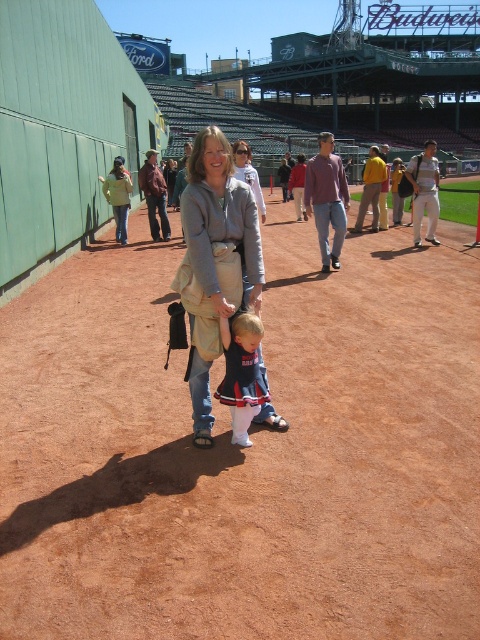
Question: From the image, what is the correct spatial relationship of matte gray sweatshirt at center in relation to matte blue dress at center?

Choices:
 (A) above
 (B) below

Answer: (A)

Question: Which point appears farthest from the camera in this image?

Choices:
 (A) (180, 196)
 (B) (220, 390)
 (C) (233, 564)

Answer: (A)

Question: Which object appears farthest from the camera in this image?

Choices:
 (A) matte gray hoodie at center
 (B) brown dirt field at center

Answer: (A)

Question: Which point appears farthest from the camera in this image?

Choices:
 (A) (372, 324)
 (B) (379, 188)
 (C) (260, 340)

Answer: (B)

Question: Can you confirm if matte gray hoodie at center is positioned above matte gray sweatshirt at center?

Choices:
 (A) yes
 (B) no

Answer: (B)

Question: Does matte gray sweatshirt at center have a greater width compared to matte blue dress at center?

Choices:
 (A) no
 (B) yes

Answer: (B)